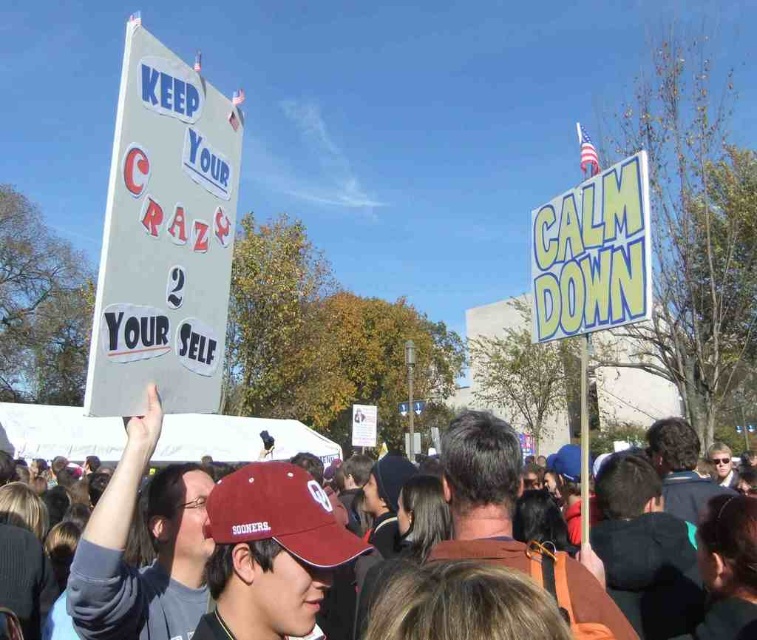
You are a photographer standing at the front of the protest scene. You want to take a closeup photo of the white cardboard sign at upper left. Considering your camera can focus on objects within 5 feet, will you be able to capture a clear closeup of the sign?

The white cardboard sign at upper left is 5.70 feet away from the viewer. Since your camera can focus within 5 feet, you are too far to capture a clear closeup. Move closer to within 5 feet for better focus.